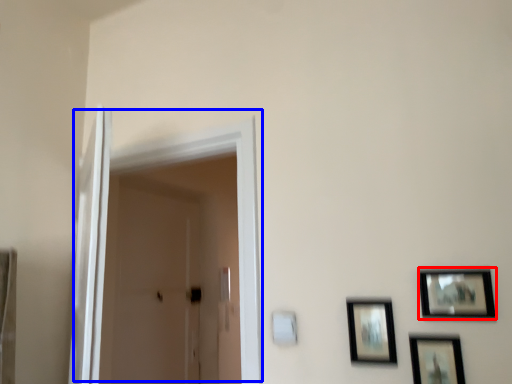
Question: Among these objects, which one is farthest to the camera, picture frame (highlighted by a red box) or door (highlighted by a blue box)?

Choices:
 (A) picture frame
 (B) door

Answer: (B)